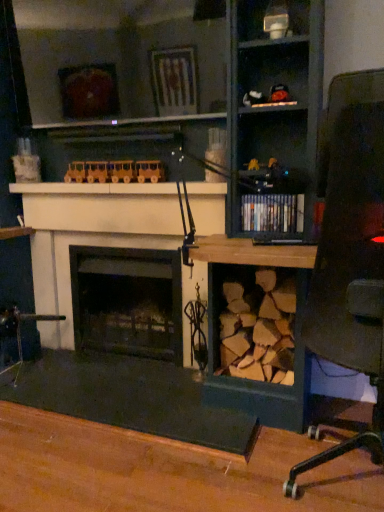
Locate an element on the screen. This screenshot has height=512, width=384. free point above white matte fireplace at center, positioned as the 1th fireplace in front-to-back order (from a real-world perspective) is located at coordinates (110, 196).